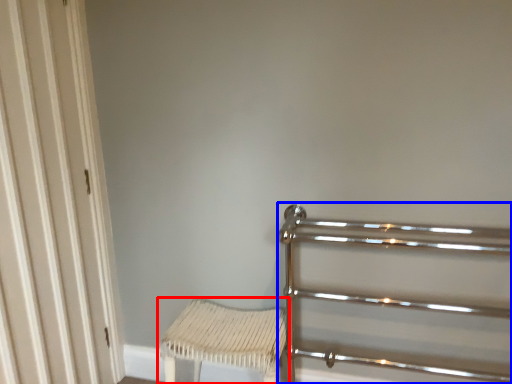
Question: Which object appears closest to the camera in this image, furniture (highlighted by a red box) or rail (highlighted by a blue box)?

Choices:
 (A) furniture
 (B) rail

Answer: (B)